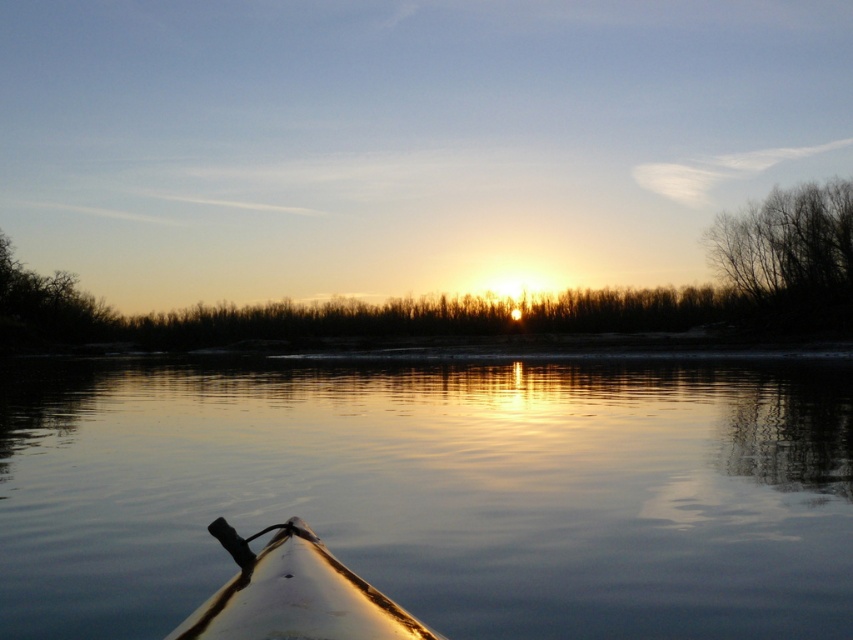
You are sitting in the kayak and want to reach the branches to pick something. Based on the scene, can you tell if the bare branches at upper right are within your immediate reach from the white glossy kayak at lower center?

The white glossy kayak at lower center is closer to the viewer than the bare branches at upper right, so the branches are farther away and likely not within immediate reach from the kayak.

You are in a kayak facing the sunset. You want to know where the glossy water at center is located. Can you describe its position using coordinates?

The glossy water at center is located at coordinates point (434, 492).